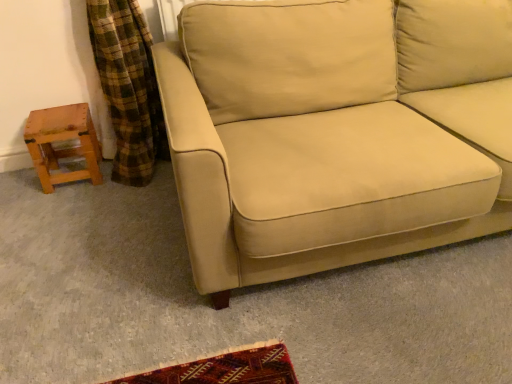
Question: Is point (404, 158) positioned closer to the camera than point (76, 112)?

Choices:
 (A) farther
 (B) closer

Answer: (B)

Question: Would you say beige fabric couch at center is inside or outside wooden stool at left?

Choices:
 (A) outside
 (B) inside

Answer: (A)

Question: Looking at the image, does beige fabric couch at center seem bigger or smaller compared to wooden stool at left?

Choices:
 (A) small
 (B) big

Answer: (B)

Question: Visually, is wooden stool at left positioned to the left or to the right of beige fabric couch at center?

Choices:
 (A) left
 (B) right

Answer: (A)

Question: From a real-world perspective, relative to beige fabric couch at center, is wooden stool at left vertically above or below?

Choices:
 (A) above
 (B) below

Answer: (B)

Question: Looking at their shapes, would you say wooden stool at left is wider or thinner than beige fabric couch at center?

Choices:
 (A) wide
 (B) thin

Answer: (B)

Question: Considering the positions of wooden stool at left and beige fabric couch at center in the image, is wooden stool at left bigger or smaller than beige fabric couch at center?

Choices:
 (A) big
 (B) small

Answer: (B)